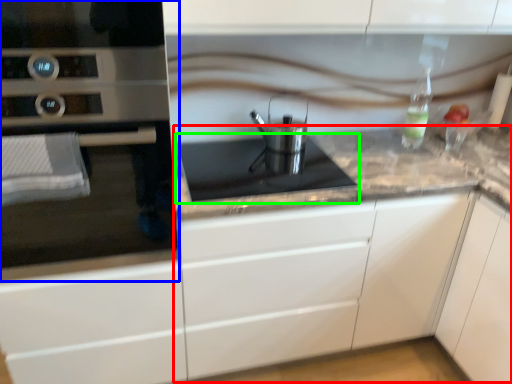
Question: Which object is positioned closest to counter (highlighted by a red box)? Select from home appliance (highlighted by a blue box) and gas stove (highlighted by a green box).

Choices:
 (A) home appliance
 (B) gas stove

Answer: (B)